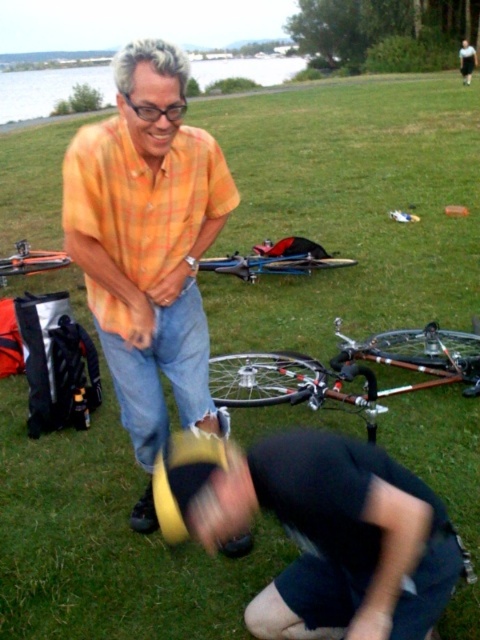
You are a photographer trying to capture a group photo of the orange plaid shirt at center and the dark gray fabric squat at lower center. If you want to ensure both subjects are fully visible in the frame, which subject should you position closer to the camera to avoid cropping?

The orange plaid shirt at center has a lesser width compared to dark gray fabric squat at lower center, so positioning the orange plaid shirt at center closer to the camera will ensure both subjects are fully visible without cropping.

You are a photographer trying to capture a candid shot of both the orange plaid shirt at center and the dark gray fabric squat at lower center. Since you want to ensure both subjects are in focus, you need to know their relative positions. Which subject is closer to the camera?

The dark gray fabric squat at lower center is behind the orange plaid shirt at center, so the orange plaid shirt at center is closer to the camera.

You are a photographer standing at the edge of the park. You want to take a photo of the orange plaid shirt at center and the silver metallic bicycle at center. Which object should you focus on first if you want to capture both in sharp focus?

The orange plaid shirt at center is closer to the viewer than the silver metallic bicycle at center. To capture both in sharp focus, you should focus on the orange plaid shirt at center first, as it is closer, and the depth of field may extend to the bicycle.